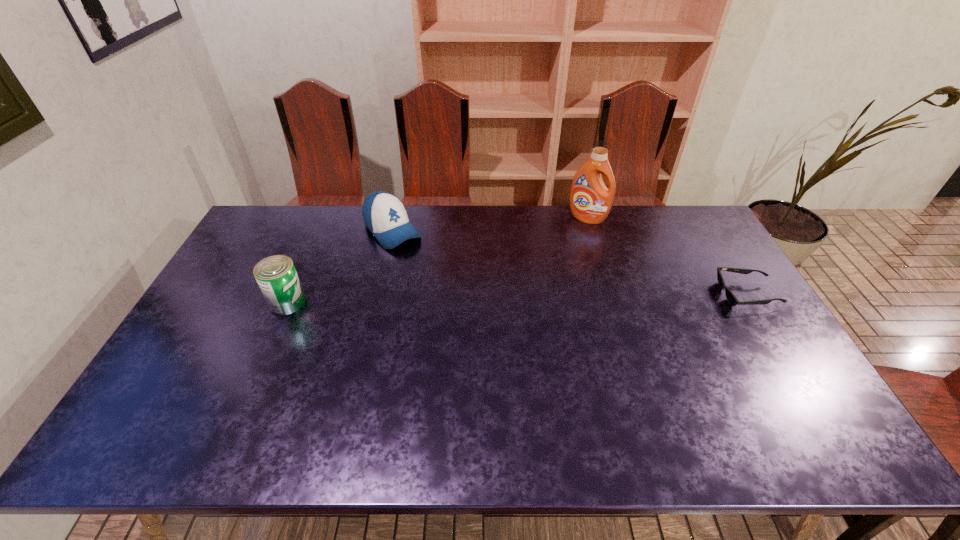
Where is `free space in the image that satisfies the following two spatial constraints: 1. on the back side of the baseball cap; 2. on the left side of the second object from right to left`? This screenshot has height=540, width=960. free space in the image that satisfies the following two spatial constraints: 1. on the back side of the baseball cap; 2. on the left side of the second object from right to left is located at coordinates (396, 218).

I want to click on free space in the image that satisfies the following two spatial constraints: 1. on the back side of the can; 2. on the front-facing side of the sunglasses, so click(x=291, y=294).

Identify the location of blank area in the image that satisfies the following two spatial constraints: 1. on the back side of the tallest object; 2. on the left side of the second object from left to right. (396, 218).